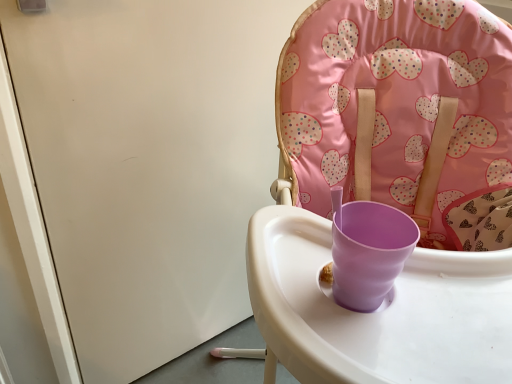
Where is `white glossy screen door at upper left`? white glossy screen door at upper left is located at coordinates (148, 164).

What do you see at coordinates (148, 164) in the screenshot? Image resolution: width=512 pixels, height=384 pixels. I see `white glossy screen door at upper left` at bounding box center [148, 164].

Measure the distance between white glossy screen door at upper left and camera.

white glossy screen door at upper left is 60.18 centimeters from camera.

This screenshot has height=384, width=512. What do you see at coordinates (403, 122) in the screenshot? I see `matte plastic highchair at center` at bounding box center [403, 122].

You are a GUI agent. You are given a task and a screenshot of the screen. Output one action in this format:
    pyautogui.click(x=<x>, y=<y>)
    Task: Click on the matte plastic highchair at center
    The width and height of the screenshot is (512, 384).
    Given the screenshot: What is the action you would take?
    pyautogui.click(x=403, y=122)

This screenshot has width=512, height=384. I want to click on white glossy screen door at upper left, so click(x=148, y=164).

Consider the image. Visually, is matte plastic highchair at center positioned to the left or to the right of white glossy screen door at upper left?

matte plastic highchair at center is to the right of white glossy screen door at upper left.

Considering the relative positions of matte plastic highchair at center and white glossy screen door at upper left in the image provided, is matte plastic highchair at center in front of white glossy screen door at upper left?

Yes, matte plastic highchair at center is in front of white glossy screen door at upper left.

Is point (479, 345) positioned in front of point (228, 323)?

Yes, point (479, 345) is closer to viewer.

From the image's perspective, would you say matte plastic highchair at center is positioned over white glossy screen door at upper left?

No, from the image's perspective, matte plastic highchair at center is not above white glossy screen door at upper left.

From a real-world perspective, is matte plastic highchair at center above or below white glossy screen door at upper left?

From a real-world perspective, matte plastic highchair at center is physically below white glossy screen door at upper left.

Does matte plastic highchair at center have a greater width compared to white glossy screen door at upper left?

Correct, the width of matte plastic highchair at center exceeds that of white glossy screen door at upper left.

Considering the relative sizes of matte plastic highchair at center and white glossy screen door at upper left in the image provided, is matte plastic highchair at center taller than white glossy screen door at upper left?

Correct, matte plastic highchair at center is much taller as white glossy screen door at upper left.

Does matte plastic highchair at center have a smaller size compared to white glossy screen door at upper left?

No.

Would you say matte plastic highchair at center is inside or outside white glossy screen door at upper left?

matte plastic highchair at center cannot be found inside white glossy screen door at upper left.

Is matte plastic highchair at center in contact with white glossy screen door at upper left?

matte plastic highchair at center and white glossy screen door at upper left are clearly separated.

Could you tell me if matte plastic highchair at center is facing white glossy screen door at upper left?

No.

The height and width of the screenshot is (384, 512). Identify the location of chair lying on the right of white glossy screen door at upper left. (403, 122).

Which object is positioned more to the left, white glossy screen door at upper left or matte plastic highchair at center?

white glossy screen door at upper left is more to the left.

Considering their positions, is white glossy screen door at upper left located in front of or behind matte plastic highchair at center?

In the image, white glossy screen door at upper left appears behind matte plastic highchair at center.

Which is closer to the camera, [168,348] or [334,337]?

The point [334,337] is in front.

From the image's perspective, is white glossy screen door at upper left below matte plastic highchair at center?

No, from the image's perspective, white glossy screen door at upper left is not below matte plastic highchair at center.

From a real-world perspective, is white glossy screen door at upper left located beneath matte plastic highchair at center?

Incorrect, from a real-world perspective, white glossy screen door at upper left is higher than matte plastic highchair at center.

In terms of width, does white glossy screen door at upper left look wider or thinner when compared to matte plastic highchair at center?

Considering their sizes, white glossy screen door at upper left looks slimmer than matte plastic highchair at center.

Who is shorter, white glossy screen door at upper left or matte plastic highchair at center?

With less height is white glossy screen door at upper left.

Can you confirm if white glossy screen door at upper left is smaller than matte plastic highchair at center?

Yes.

Is white glossy screen door at upper left spatially inside matte plastic highchair at center, or outside of it?

The correct answer is: outside.

Are white glossy screen door at upper left and matte plastic highchair at center far apart?

No.

Is white glossy screen door at upper left oriented towards matte plastic highchair at center?

Yes, white glossy screen door at upper left is oriented towards matte plastic highchair at center.

How different are the orientations of white glossy screen door at upper left and matte plastic highchair at center in degrees?

The angular difference between white glossy screen door at upper left and matte plastic highchair at center is 41.9 degrees.

How far apart are white glossy screen door at upper left and matte plastic highchair at center?

A distance of 15.58 inches exists between white glossy screen door at upper left and matte plastic highchair at center.

Image resolution: width=512 pixels, height=384 pixels. I want to click on screen door behind the matte plastic highchair at center, so click(148, 164).

The height and width of the screenshot is (384, 512). What are the coordinates of `chair on the right of white glossy screen door at upper left` in the screenshot? It's located at (403, 122).

This screenshot has height=384, width=512. I want to click on chair below the white glossy screen door at upper left (from a real-world perspective), so click(x=403, y=122).